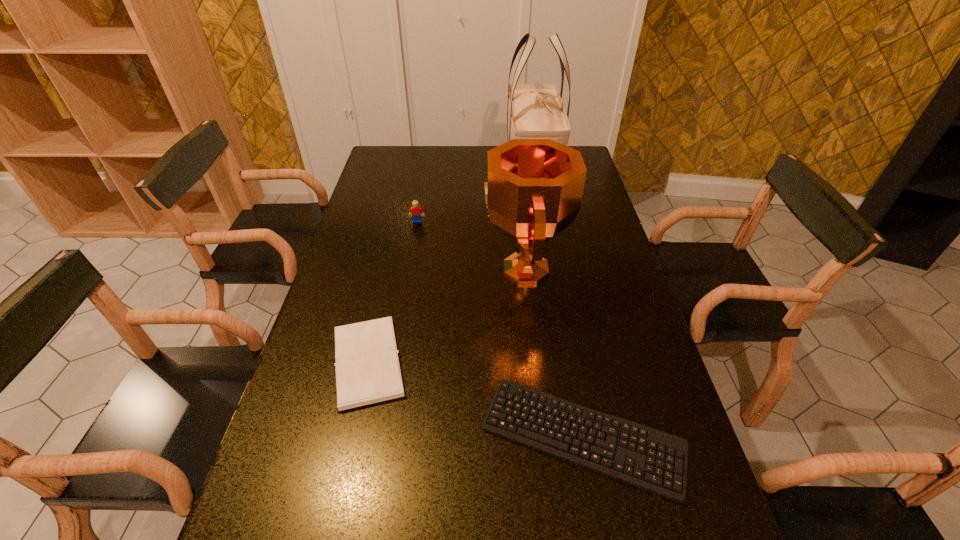
Locate an element on the screen. The height and width of the screenshot is (540, 960). free space that satisfies the following two spatial constraints: 1. on the back side of the shortest object; 2. on the side of the third farthest object with the star emblem is located at coordinates (553, 269).

Locate an element on the screen. The image size is (960, 540). vacant space that satisfies the following two spatial constraints: 1. with handles facing forward on the shopping bag; 2. on the right side of the computer keyboard is located at coordinates (575, 436).